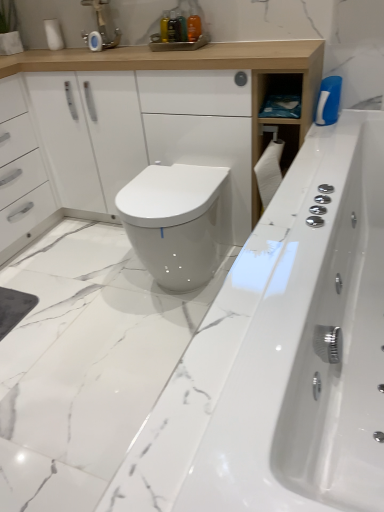
Locate an element on the screen. The height and width of the screenshot is (512, 384). white glossy cabinet at upper center is located at coordinates (196, 67).

Describe the element at coordinates (196, 67) in the screenshot. This screenshot has width=384, height=512. I see `white glossy cabinet at upper center` at that location.

What is the approximate width of matte silver faucet at upper center?

matte silver faucet at upper center is 9.72 centimeters wide.

The height and width of the screenshot is (512, 384). What do you see at coordinates (283, 354) in the screenshot?
I see `white glossy bathtub at center` at bounding box center [283, 354].

Measure the distance between point (x=47, y=27) and camera.

The depth of point (x=47, y=27) is 2.06 meters.

Describe the element at coordinates (174, 222) in the screenshot. I see `white glossy bidet at center` at that location.

Locate an element on the screen. white glossy cabinet at upper center is located at coordinates (196, 67).

Looking at this image, is white matte toilet paper at upper left bigger or smaller than white glossy bidet at center?

Considering their sizes, white matte toilet paper at upper left takes up less space than white glossy bidet at center.

Is white matte toilet paper at upper left directly adjacent to white glossy bidet at center?

There is a gap between white matte toilet paper at upper left and white glossy bidet at center.

From a real-world perspective, which object rests below the other?

white glossy bidet at center, from a real-world perspective.

Considering the relative positions of white matte toilet paper at upper left and white glossy bidet at center in the image provided, is white matte toilet paper at upper left to the left of white glossy bidet at center from the viewer's perspective?

Correct, you'll find white matte toilet paper at upper left to the left of white glossy bidet at center.

From a real-world perspective, between white glossy bidet at center and white glossy cabinet at upper center, who is vertically lower?

From a 3D spatial view, white glossy bidet at center is below.

Does white glossy bidet at center have a lesser height compared to white glossy cabinet at upper center?

Indeed, white glossy bidet at center has a lesser height compared to white glossy cabinet at upper center.

Is white glossy bidet at center beside white glossy cabinet at upper center?

white glossy bidet at center and white glossy cabinet at upper center are not in contact.

From the image's perspective, who appears lower, white glossy bidet at center or white glossy cabinet at upper center?

From the image's view, white glossy bidet at center is below.

Would you say matte silver faucet at upper center is inside or outside white matte toilet paper at upper left?

matte silver faucet at upper center is spatially situated outside white matte toilet paper at upper left.

Measure the distance between matte silver faucet at upper center and white matte toilet paper at upper left.

The distance of matte silver faucet at upper center from white matte toilet paper at upper left is 9.27 inches.

You are a GUI agent. You are given a task and a screenshot of the screen. Output one action in this format:
    pyautogui.click(x=<x>, y=<y>)
    Task: Click on the toilet paper below the matte silver faucet at upper center (from a real-world perspective)
    
    Given the screenshot: What is the action you would take?
    pyautogui.click(x=53, y=34)

From a real-world perspective, is matte silver faucet at upper center under white matte toilet paper at upper left?

No.

From a real-world perspective, which object stands above the other?

In real-world perspective, matte silver faucet at upper center is above.

From the image's perspective, which one is positioned lower, matte silver faucet at upper center or white glossy bathtub at center?

white glossy bathtub at center appears lower in the image.

Is white glossy bathtub at center completely or partially inside matte silver faucet at upper center?

No.

Is matte silver faucet at upper center beside white glossy bathtub at center?

There is a gap between matte silver faucet at upper center and white glossy bathtub at center.

Which of these two, white glossy bathtub at center or white glossy cabinet at upper center, stands shorter?

With less height is white glossy bathtub at center.

Consider the image. Could you tell me if white glossy bathtub at center is facing white glossy cabinet at upper center?

Yes, white glossy bathtub at center is aimed at white glossy cabinet at upper center.

From the image's perspective, is white glossy bathtub at center above or below white glossy cabinet at upper center?

From the image's perspective, white glossy bathtub at center appears below white glossy cabinet at upper center.

Where is `bidet below the white glossy bathtub at center (from a real-world perspective)`? This screenshot has width=384, height=512. bidet below the white glossy bathtub at center (from a real-world perspective) is located at coordinates (174, 222).

Is white glossy bathtub at center to the right of white glossy bidet at center from the viewer's perspective?

Correct, you'll find white glossy bathtub at center to the right of white glossy bidet at center.

Could you tell me if white glossy bathtub at center is facing white glossy bidet at center?

Yes.

Is white matte toilet paper at upper left situated inside matte silver faucet at upper center or outside?

white matte toilet paper at upper left exists outside the volume of matte silver faucet at upper center.

Which of these two, white matte toilet paper at upper left or matte silver faucet at upper center, is bigger?

With larger size is matte silver faucet at upper center.

Measure the distance between white matte toilet paper at upper left and matte silver faucet at upper center.

white matte toilet paper at upper left and matte silver faucet at upper center are 9.27 inches apart.

Consider the image. How many degrees apart are the facing directions of white matte toilet paper at upper left and matte silver faucet at upper center?

1.16 degrees separate the facing orientations of white matte toilet paper at upper left and matte silver faucet at upper center.

This screenshot has width=384, height=512. What are the coordinates of `bidet on the right side of white matte toilet paper at upper left` in the screenshot? It's located at (174, 222).

This screenshot has height=512, width=384. In order to click on bathroom cabinet that appears on the left of white glossy bidet at center in this screenshot , I will do `click(196, 67)`.

Looking at this image, considering their positions, is white matte toilet paper at upper left positioned closer to matte silver faucet at upper center than white glossy bidet at center?

white matte toilet paper at upper left is closer to matte silver faucet at upper center.

Which object lies further to the anchor point white matte toilet paper at upper left, white glossy bidet at center or white glossy cabinet at upper center?

Based on the image, white glossy bidet at center appears to be further to white matte toilet paper at upper left.

From the image, which object appears to be nearer to white glossy bathtub at center, white matte toilet paper at upper left or white glossy cabinet at upper center?

Based on the image, white glossy cabinet at upper center appears to be nearer to white glossy bathtub at center.

When comparing their distances from white glossy bathtub at center, does matte silver faucet at upper center or white glossy bidet at center seem further?

matte silver faucet at upper center lies further to white glossy bathtub at center than the other object.

Based on their spatial positions, is white glossy bidet at center or white glossy bathtub at center closer to matte silver faucet at upper center?

The object closer to matte silver faucet at upper center is white glossy bidet at center.

Which object lies nearer to the anchor point white glossy bidet at center, white matte toilet paper at upper left or matte silver faucet at upper center?

Among the two, matte silver faucet at upper center is located nearer to white glossy bidet at center.

When comparing their distances from white glossy bathtub at center, does white matte toilet paper at upper left or matte silver faucet at upper center seem closer?

matte silver faucet at upper center is positioned closer to the anchor white glossy bathtub at center.

Based on their spatial positions, is white matte toilet paper at upper left or white glossy cabinet at upper center further from matte silver faucet at upper center?

white glossy cabinet at upper center is further to matte silver faucet at upper center.

You are a GUI agent. You are given a task and a screenshot of the screen. Output one action in this format:
    pyautogui.click(x=<x>, y=<y>)
    Task: Click on the bidet positioned between white glossy bathtub at center and white matte toilet paper at upper left from near to far
    This screenshot has width=384, height=512.
    Given the screenshot: What is the action you would take?
    pyautogui.click(x=174, y=222)

Find the location of `faucet between white glossy bathtub at center and white matte toilet paper at upper left in the front-back direction`. faucet between white glossy bathtub at center and white matte toilet paper at upper left in the front-back direction is located at coordinates (100, 28).

At what (x,y) coordinates should I click in order to perform the action: click on bidet between white glossy bathtub at center and matte silver faucet at upper center from front to back. Please return your answer as a coordinate pair (x, y). Looking at the image, I should click on (174, 222).

Locate an element on the screen. This screenshot has width=384, height=512. bathroom cabinet between matte silver faucet at upper center and white glossy bidet at center in the vertical direction is located at coordinates (196, 67).